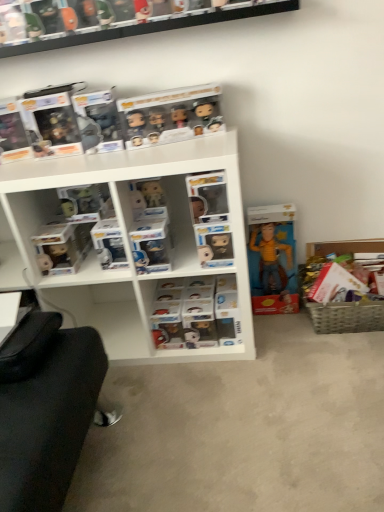
Identify the location of vacant area in front of woven basket at lower right. (352, 362).